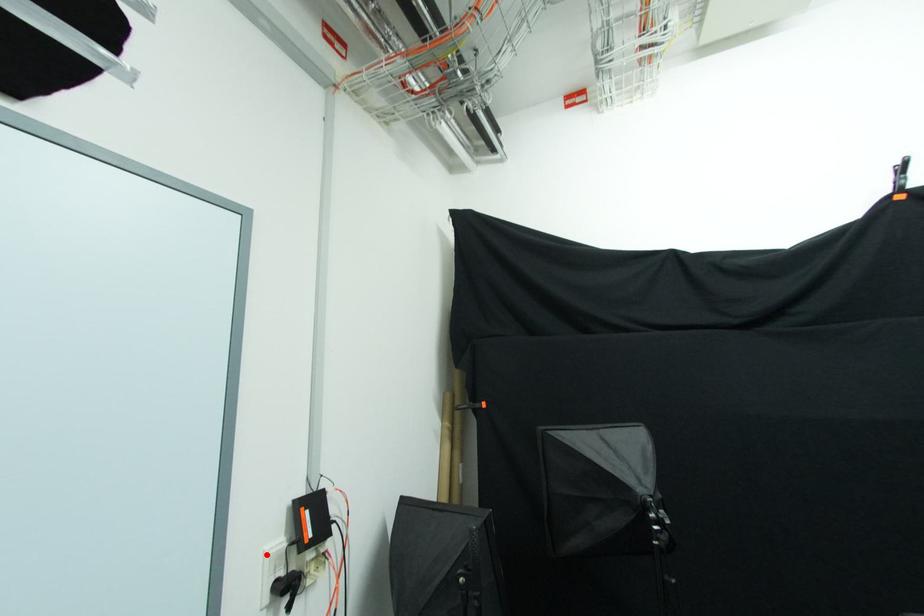
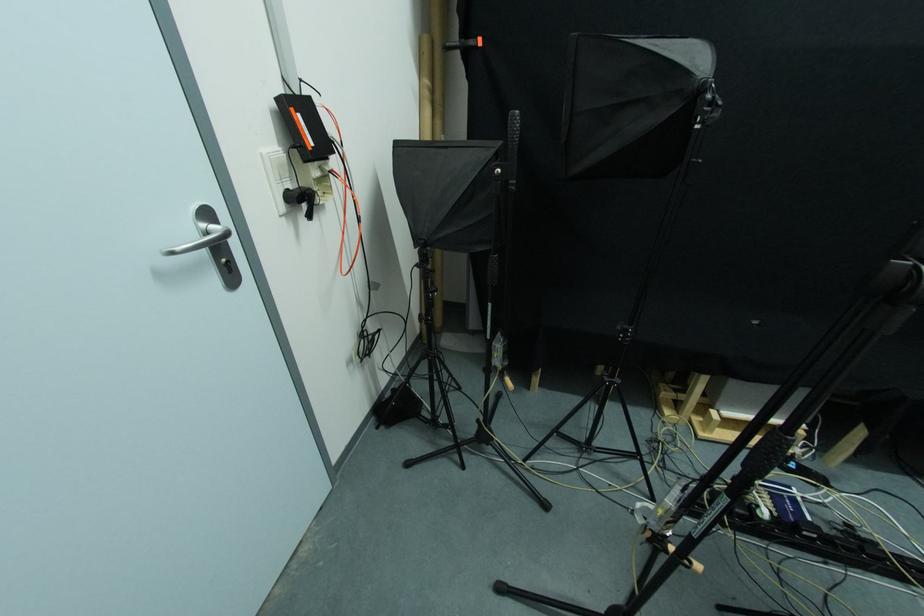
Locate, in the second image, the point that corresponds to the highlighted location in the first image.

(262, 156)